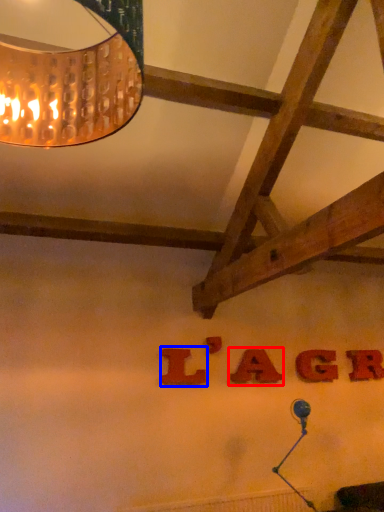
Question: Which object is closer to the camera taking this photo, letter (highlighted by a red box) or letter (highlighted by a blue box)?

Choices:
 (A) letter
 (B) letter

Answer: (B)